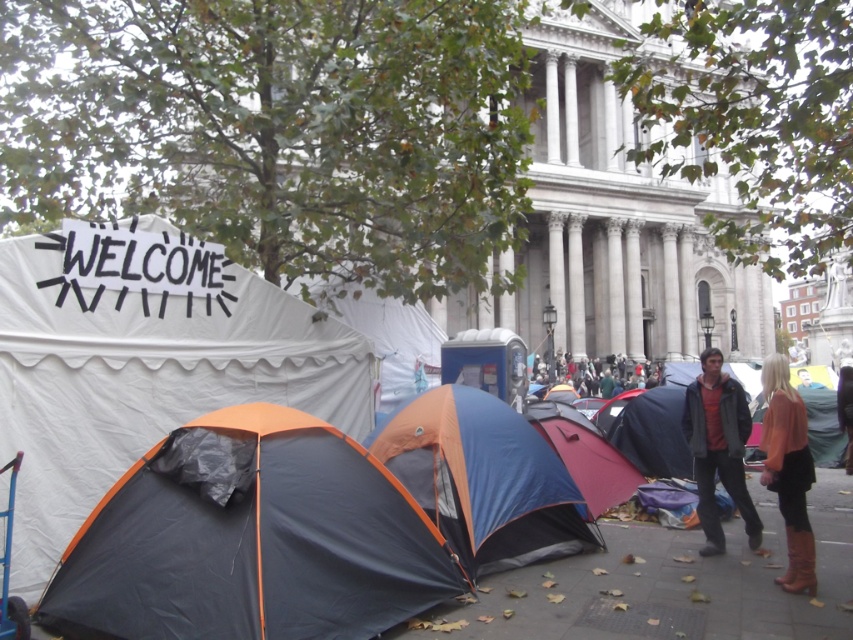
You are a visitor in the public square and want to find the white canvas tent at left and the black tarpaulin tent at lower left. Which tent is positioned more to the left side of the square?

The white canvas tent at left is positioned more to the left side of the square than the black tarpaulin tent at lower left.